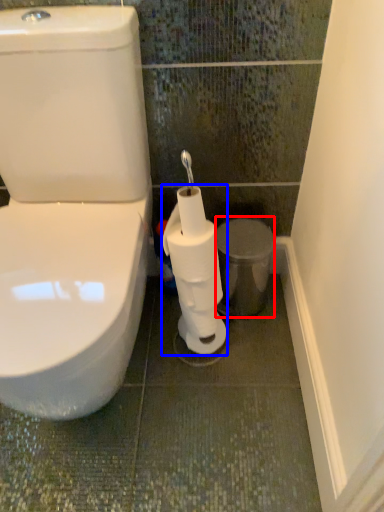
Question: Which of the following is the farthest to the observer, porcelain (highlighted by a red box) or toilet paper (highlighted by a blue box)?

Choices:
 (A) porcelain
 (B) toilet paper

Answer: (A)